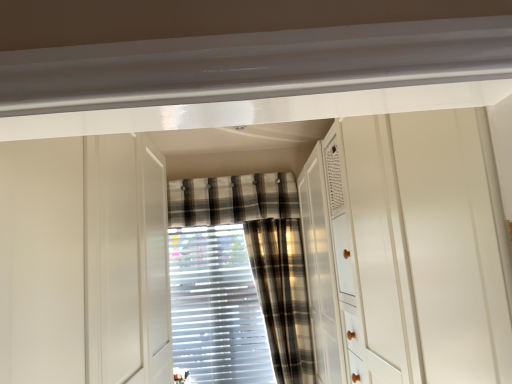
Question: Is white glossy dresser at center thinner than plaid fabric curtain at center, the third curtain from the back?

Choices:
 (A) no
 (B) yes

Answer: (A)

Question: From a real-world perspective, is white glossy dresser at center positioned over plaid fabric curtain at center, the third curtain from the back, based on gravity?

Choices:
 (A) no
 (B) yes

Answer: (B)

Question: Is white glossy dresser at center further to camera compared to plaid fabric curtain at center, the third curtain from the back?

Choices:
 (A) yes
 (B) no

Answer: (B)

Question: Does white glossy dresser at center turn towards plaid fabric curtain at center, the first curtain from the front?

Choices:
 (A) no
 (B) yes

Answer: (B)

Question: From the image's perspective, is white glossy dresser at center over plaid fabric curtain at center, the first curtain from the front?

Choices:
 (A) no
 (B) yes

Answer: (B)

Question: From the image's perspective, would you say white glossy dresser at center is shown under plaid fabric curtain at center, the first curtain from the front?

Choices:
 (A) no
 (B) yes

Answer: (A)

Question: Can you confirm if plaid fabric curtain at center, acting as the 2th curtain starting from the front, is bigger than plaid fabric curtain at center, the 3th curtain positioned from the front?

Choices:
 (A) no
 (B) yes

Answer: (A)

Question: Does plaid fabric curtain at center, which ranks as the second curtain in back-to-front order, have a lesser height compared to plaid fabric curtain at center, the first curtain viewed from the back?

Choices:
 (A) no
 (B) yes

Answer: (B)

Question: From a real-world perspective, is plaid fabric curtain at center, acting as the 2th curtain starting from the front, on plaid fabric curtain at center, the 3th curtain positioned from the front?

Choices:
 (A) yes
 (B) no

Answer: (A)

Question: Is plaid fabric curtain at center, the first curtain viewed from the back, at the back of plaid fabric curtain at center, which ranks as the second curtain in back-to-front order?

Choices:
 (A) no
 (B) yes

Answer: (A)

Question: Can you confirm if plaid fabric curtain at center, acting as the 2th curtain starting from the front, is positioned to the left of plaid fabric curtain at center, the first curtain viewed from the back?

Choices:
 (A) yes
 (B) no

Answer: (B)

Question: Is plaid fabric curtain at center, acting as the 2th curtain starting from the front, to the right of plaid fabric curtain at center, the first curtain viewed from the back, from the viewer's perspective?

Choices:
 (A) no
 (B) yes

Answer: (B)

Question: Is plaid fabric curtain at center, the third curtain from the back, thinner than plaid fabric curtain at center, acting as the 2th curtain starting from the front?

Choices:
 (A) no
 (B) yes

Answer: (A)